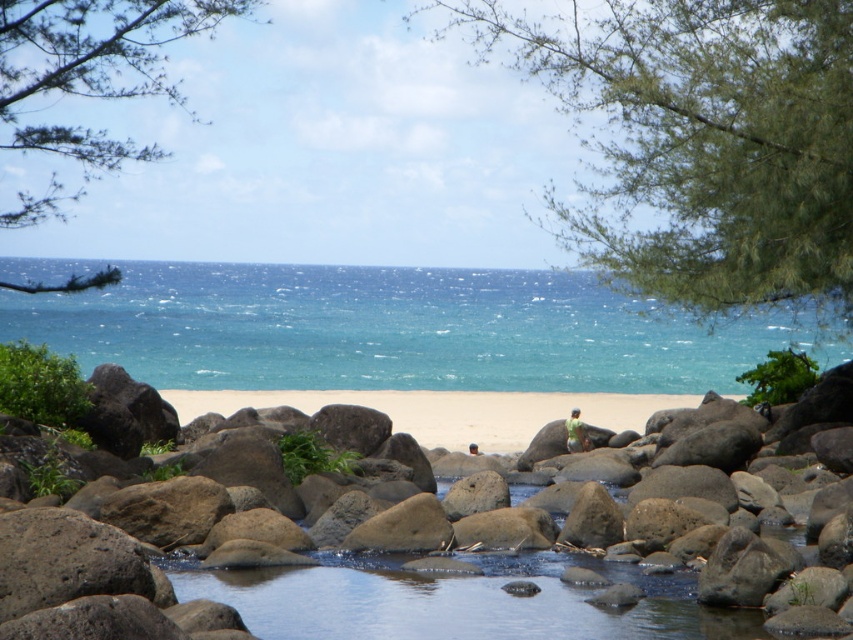
Does point (450, 321) come behind point (16, 141)?

Yes.

Who is more distant from viewer, (229, 374) or (6, 36)?

Positioned behind is point (229, 374).

Find the location of `blue water at center`. blue water at center is located at coordinates (395, 332).

Measure the distance between blue water at center and camera.

blue water at center is 24.96 meters from camera.

Between blue water at center and green fabric shirt at center, which one is positioned lower?

Positioned lower is green fabric shirt at center.

Where is `blue water at center`? This screenshot has height=640, width=853. blue water at center is located at coordinates (395, 332).

Is point (94, 20) positioned before point (576, 419)?

Yes, it is in front of point (576, 419).

Consider the image. Who is more forward, (0,115) or (577,426)?

Point (0,115) is in front.

You are a GUI agent. You are given a task and a screenshot of the screen. Output one action in this format:
    pyautogui.click(x=<x>, y=<y>)
    Task: Click on the green leafy branch at upper left
    
    Given the screenshot: What is the action you would take?
    pyautogui.click(x=93, y=65)